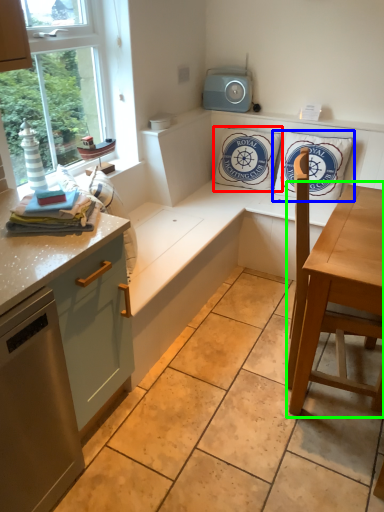
Question: Which object is positioned farthest from pillow (highlighted by a red box)? Select from pillow (highlighted by a blue box) and table (highlighted by a green box).

Choices:
 (A) pillow
 (B) table

Answer: (B)